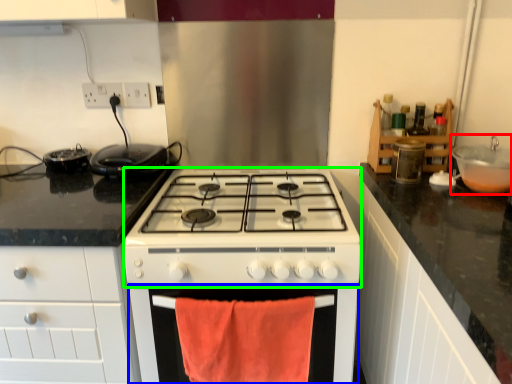
Question: Estimate the real-world distances between objects in this image. Which object is farther from sink (highlighted by a red box), oven (highlighted by a blue box) or gas stove (highlighted by a green box)?

Choices:
 (A) oven
 (B) gas stove

Answer: (A)